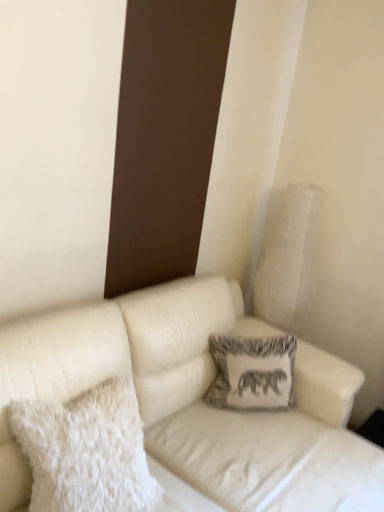
Question: Can you confirm if white textured pillow at upper right, acting as the first pillow starting from the right, is positioned to the right of white fluffy pillow at left, which is counted as the first pillow, starting from the left?

Choices:
 (A) no
 (B) yes

Answer: (B)

Question: Is white textured pillow at upper right, acting as the first pillow starting from the right, facing away from white fluffy pillow at left, which is counted as the first pillow, starting from the left?

Choices:
 (A) yes
 (B) no

Answer: (B)

Question: From a real-world perspective, is white textured pillow at upper right, the 1th pillow positioned from the back, positioned over white fluffy pillow at left, which is the third pillow in back-to-front order, based on gravity?

Choices:
 (A) yes
 (B) no

Answer: (A)

Question: From a real-world perspective, is white textured pillow at upper right, the 1th pillow positioned from the back, below white fluffy pillow at left, marked as the third pillow in a right-to-left arrangement?

Choices:
 (A) yes
 (B) no

Answer: (B)

Question: Can you confirm if white textured pillow at upper right, acting as the first pillow starting from the right, is shorter than white fluffy pillow at left, which is counted as the first pillow, starting from the left?

Choices:
 (A) yes
 (B) no

Answer: (B)

Question: Is point (74, 364) closer or farther from the camera than point (258, 355)?

Choices:
 (A) farther
 (B) closer

Answer: (B)

Question: From their relative heights in the image, would you say white leather couch at center is taller or shorter than printed fabric pillow at center, the 2th pillow viewed from the front?

Choices:
 (A) tall
 (B) short

Answer: (A)

Question: Would you say white leather couch at center is to the left or to the right of printed fabric pillow at center, the 2th pillow positioned from the back, in the picture?

Choices:
 (A) right
 (B) left

Answer: (A)

Question: From the image's perspective, is white leather couch at center located above or below printed fabric pillow at center, the second pillow from the right?

Choices:
 (A) below
 (B) above

Answer: (A)

Question: Looking at their shapes, would you say white fluffy pillow at left, the first pillow positioned from the front, is wider or thinner than white leather couch at center?

Choices:
 (A) thin
 (B) wide

Answer: (A)

Question: Is point (51, 465) positioned closer to the camera than point (336, 431)?

Choices:
 (A) farther
 (B) closer

Answer: (B)

Question: Is white fluffy pillow at left, which is the third pillow in back-to-front order, in front of or behind white leather couch at center in the image?

Choices:
 (A) front
 (B) behind

Answer: (A)

Question: From a real-world perspective, is white fluffy pillow at left, which is counted as the first pillow, starting from the left, positioned above or below white leather couch at center?

Choices:
 (A) above
 (B) below

Answer: (A)

Question: Is printed fabric pillow at center, the 2th pillow positioned from the back, situated inside white leather couch at center or outside?

Choices:
 (A) outside
 (B) inside

Answer: (B)

Question: Is printed fabric pillow at center, the second pillow from the right, taller or shorter than white leather couch at center?

Choices:
 (A) tall
 (B) short

Answer: (B)